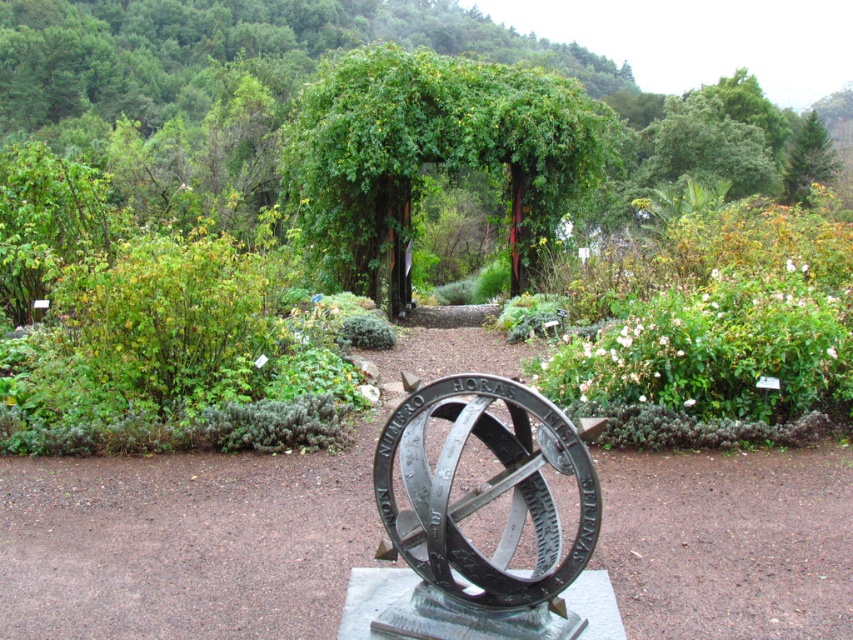
You are standing in the garden and want to walk from the green leafy bush at left to the green leafy tree at center. Which direction should you move to get closer to the tree?

You should move towards the green leafy tree at center. Since the tree is further to the viewer than the bush, moving forward towards it will bring you closer.

You are standing in the garden looking at the metal sundial. You notice two points marked in the scene. Which point, point [422,560] or point [148,291], is closer to you?

Point [422,560] is closer to the viewer than point [148,291].